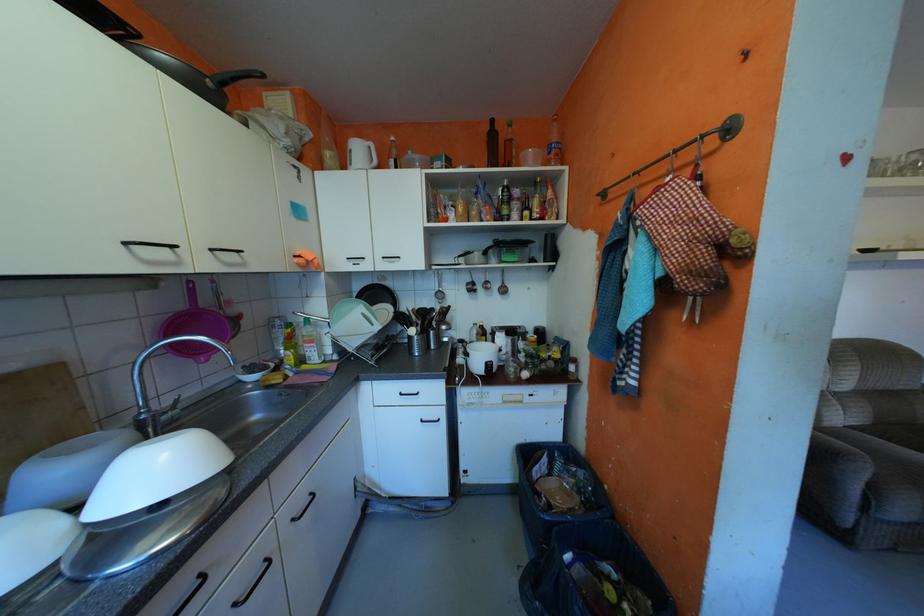
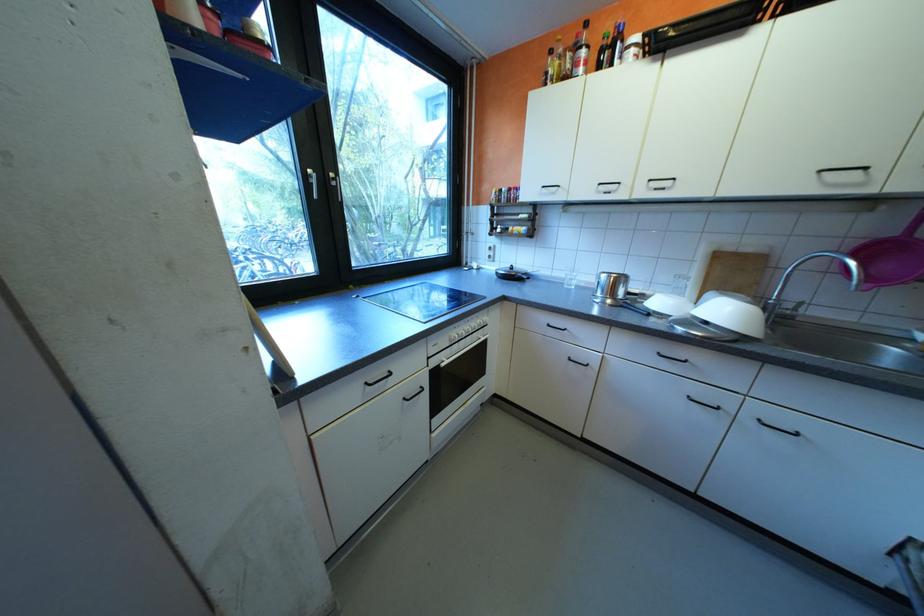
Where in the second image is the point corresponding to (x=175, y=467) from the first image?

(736, 312)